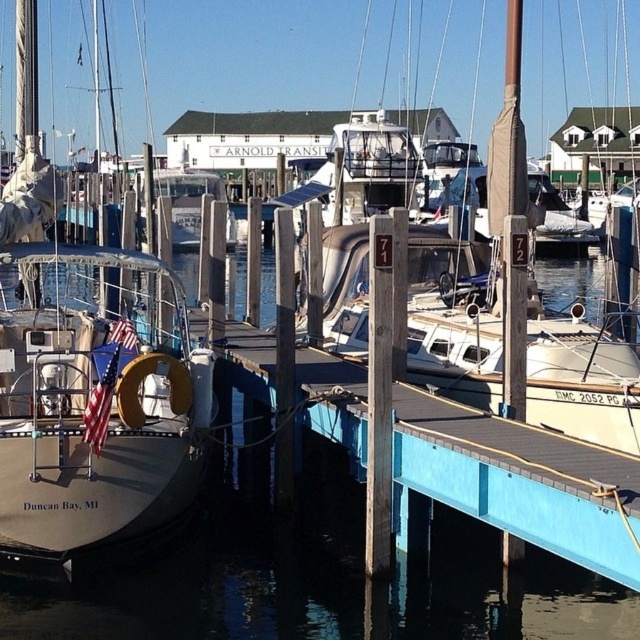
Between clear water at dock center and white matte boat at center, which one has less height?

Standing shorter between the two is white matte boat at center.

Is point (529, 577) in front of point (472, 401)?

Yes, it is in front of point (472, 401).

You are a GUI agent. You are given a task and a screenshot of the screen. Output one action in this format:
    pyautogui.click(x=<x>, y=<y>)
    Task: Click on the clear water at dock center
    The height and width of the screenshot is (640, 640).
    Given the screenshot: What is the action you would take?
    pyautogui.click(x=225, y=564)

Is point (147, 481) more distant than point (296, 266)?

No.

Between matte white sailboat at left and white matte boat at center, which one is positioned lower?

white matte boat at center

Is point (35, 115) in front of point (432, 241)?

No, (35, 115) is further to viewer.

Find the location of a particular element. Image resolution: width=640 pixels, height=640 pixels. matte white sailboat at left is located at coordinates (88, 376).

Is clear water at dock center to the right of matte white sailboat at left from the viewer's perspective?

Correct, you'll find clear water at dock center to the right of matte white sailboat at left.

Who is more distant from viewer, [269,417] or [22,154]?

Point [22,154]

You are a GUI agent. You are given a task and a screenshot of the screen. Output one action in this format:
    pyautogui.click(x=<x>, y=<y>)
    Task: Click on the clear water at dock center
    
    Given the screenshot: What is the action you would take?
    pyautogui.click(x=225, y=564)